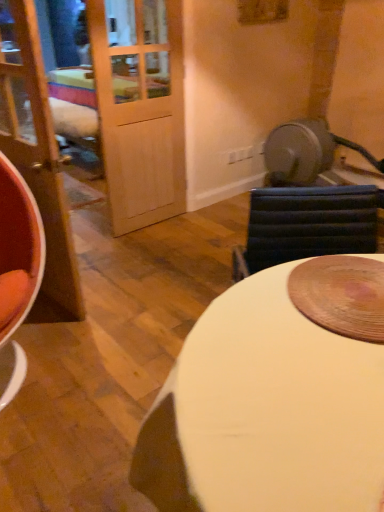
Question: From the image's perspective, is matte wood door at left located above white glossy table at center?

Choices:
 (A) no
 (B) yes

Answer: (B)

Question: Are matte wood door at left and white glossy table at center far apart?

Choices:
 (A) yes
 (B) no

Answer: (A)

Question: Is matte wood door at left turned away from white glossy table at center?

Choices:
 (A) yes
 (B) no

Answer: (B)

Question: Is matte wood door at left closer to camera compared to white glossy table at center?

Choices:
 (A) no
 (B) yes

Answer: (A)

Question: Considering the relative positions of matte wood door at left and white glossy table at center in the image provided, is matte wood door at left to the right of white glossy table at center from the viewer's perspective?

Choices:
 (A) no
 (B) yes

Answer: (A)

Question: Can you confirm if matte wood door at left is wider than white glossy table at center?

Choices:
 (A) no
 (B) yes

Answer: (A)

Question: Is white glossy table at center positioned with its back to matte wood door at left?

Choices:
 (A) no
 (B) yes

Answer: (A)

Question: Considering the relative sizes of white glossy table at center and matte wood door at left in the image provided, is white glossy table at center smaller than matte wood door at left?

Choices:
 (A) yes
 (B) no

Answer: (B)

Question: Does white glossy table at center have a greater height compared to matte wood door at left?

Choices:
 (A) no
 (B) yes

Answer: (A)

Question: Is white glossy table at center thinner than matte wood door at left?

Choices:
 (A) no
 (B) yes

Answer: (A)

Question: Would you say matte wood door at left is part of white glossy table at center's contents?

Choices:
 (A) yes
 (B) no

Answer: (B)

Question: Does white glossy table at center have a lesser height compared to matte wood door at left?

Choices:
 (A) yes
 (B) no

Answer: (A)

Question: Is matte wood door at left situated inside white glossy table at center or outside?

Choices:
 (A) inside
 (B) outside

Answer: (B)